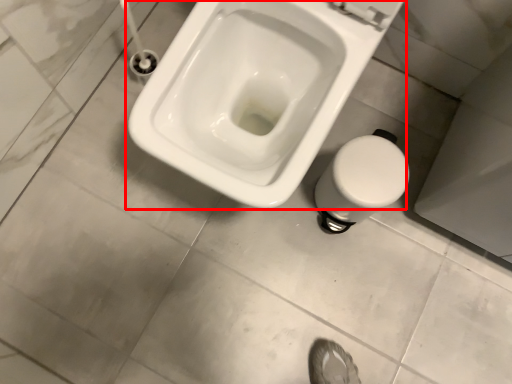
Question: Considering the relative positions of toilet (annotated by the red box) and bidet in the image provided, where is toilet (annotated by the red box) located with respect to the staircase?

Choices:
 (A) right
 (B) left

Answer: (B)